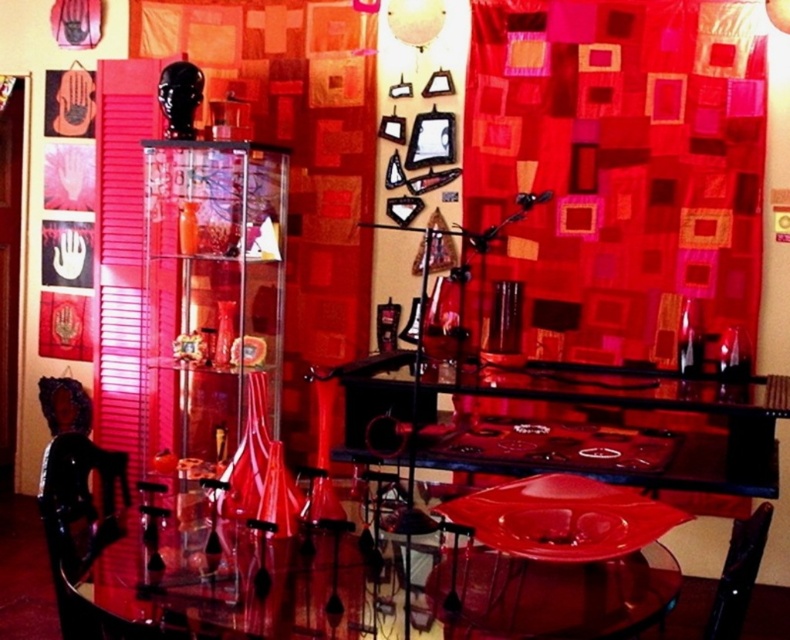
Between matte red fabric at upper right and transparent glass table at center, which one has less height?

Standing shorter between the two is transparent glass table at center.

From the picture: Does matte red fabric at upper right appear under transparent glass table at center?

No.

Measure the distance between matte red fabric at upper right and camera.

matte red fabric at upper right is 3.53 meters away from camera.

Locate an element on the screen. matte red fabric at upper right is located at coordinates (623, 164).

Can you confirm if matte red fabric at upper right is smaller than black leather chair at lower right?

Actually, matte red fabric at upper right might be larger than black leather chair at lower right.

Can you confirm if matte red fabric at upper right is thinner than black leather chair at lower right?

Incorrect, matte red fabric at upper right's width is not less than black leather chair at lower right's.

Is point (600, 120) in front of point (740, 605)?

No, (600, 120) is behind (740, 605).

Find the location of a particular element. This screenshot has height=640, width=790. matte red fabric at upper right is located at coordinates (623, 164).

Between transparent glass table at center and black leather chair at lower right, which one is positioned higher?

black leather chair at lower right is above.

You are a GUI agent. You are given a task and a screenshot of the screen. Output one action in this format:
    pyautogui.click(x=<x>, y=<y>)
    Task: Click on the transparent glass table at center
    
    Given the screenshot: What is the action you would take?
    pyautogui.click(x=213, y=586)

Does point (438, 624) come behind point (743, 621)?

No, (438, 624) is closer to viewer.

Where is `transparent glass table at center`? This screenshot has width=790, height=640. transparent glass table at center is located at coordinates (213, 586).